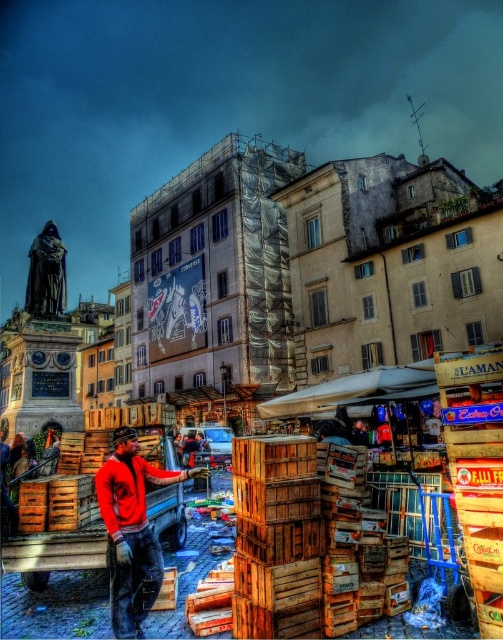
You are standing at the center of the image and want to place a new crate exactly where the wooden crates at center are located. What coordinates should you use?

You should use the coordinates point [277,548] to place the new crate exactly where the wooden crates at center are located.

You are a delivery person who needs to unload the wooden crates at center and wooden crates at lower left from the truck. The truck has a loading ramp that can only accommodate one crate at a time. If you start unloading the smaller crate first, will the larger crate fit through the same ramp without needing adjustments?

The wooden crates at center is larger in size than wooden crates at lower left. Since the smaller crate fits through the ramp, the larger crate may not fit unless adjustments are made to the ramp or the crate is modified.